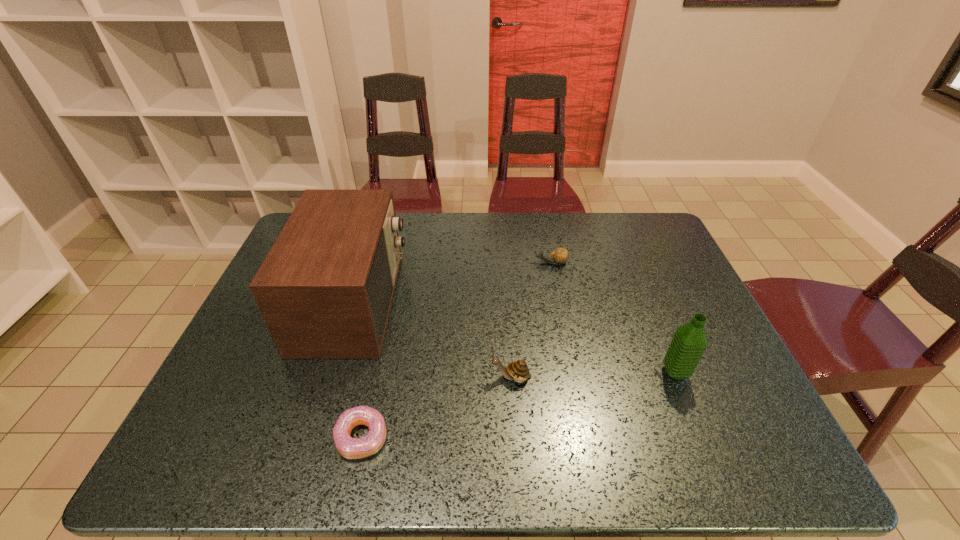
Where is `vacant area between the shortest object and the shorter escargot`? This screenshot has height=540, width=960. vacant area between the shortest object and the shorter escargot is located at coordinates (456, 350).

Locate an element on the screen. unoccupied area between the nearest object and the rightmost object is located at coordinates (518, 405).

The width and height of the screenshot is (960, 540). I want to click on free space that is in between the right escargot and the second tallest object, so click(x=613, y=318).

Locate an element on the screen. vacant space in between the tallest object and the second tallest object is located at coordinates (515, 338).

Find the location of a particular element. The height and width of the screenshot is (540, 960). blank region between the radio receiver and the nearer escargot is located at coordinates (432, 340).

Locate an element on the screen. free spot between the fourth object from left to right and the water bottle is located at coordinates [613, 318].

Find the location of `empty space between the shortest object and the water bottle`. empty space between the shortest object and the water bottle is located at coordinates (518, 405).

Locate which object ranks third in proximity to the nearest object. Please provide its 2D coordinates. Your answer should be formatted as a tuple, i.e. [(x, y)], where the tuple contains the x and y coordinates of a point satisfying the conditions above.

[(560, 255)]

Where is `object that is the closest to the tallest object`? The image size is (960, 540). object that is the closest to the tallest object is located at coordinates (350, 448).

Locate an element on the screen. vacant space that satisfies the following two spatial constraints: 1. on the front side of the rightmost object; 2. on the face of the taller escargot is located at coordinates (678, 377).